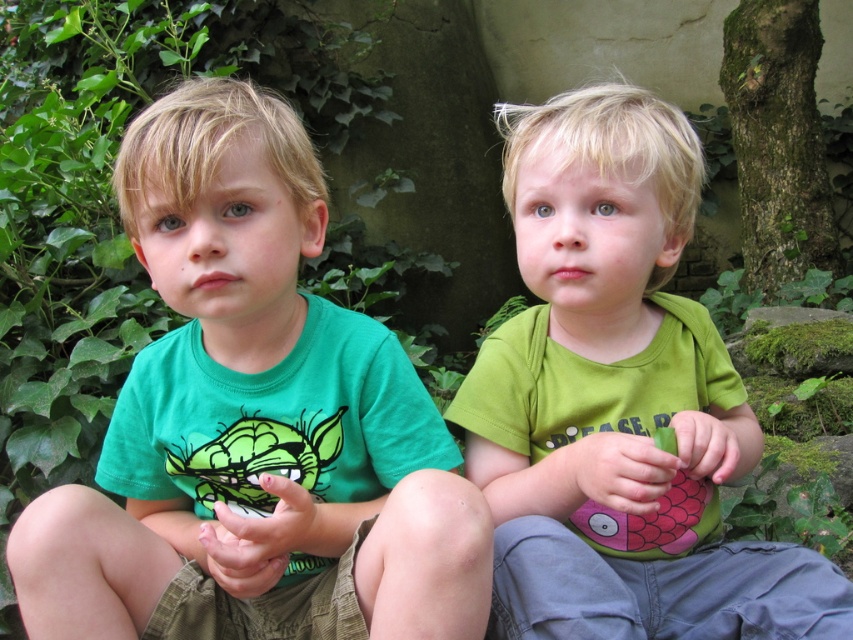
Question: Does green matte t-shirt at left come behind green matte shirt at center?

Choices:
 (A) yes
 (B) no

Answer: (B)

Question: Observing the image, what is the correct spatial positioning of green matte t-shirt at left in reference to green matte shirt at center?

Choices:
 (A) right
 (B) left

Answer: (B)

Question: Does green matte t-shirt at left have a lesser width compared to green matte shirt at center?

Choices:
 (A) yes
 (B) no

Answer: (B)

Question: Which point is farther from the camera taking this photo?

Choices:
 (A) pyautogui.click(x=664, y=618)
 (B) pyautogui.click(x=415, y=371)

Answer: (A)